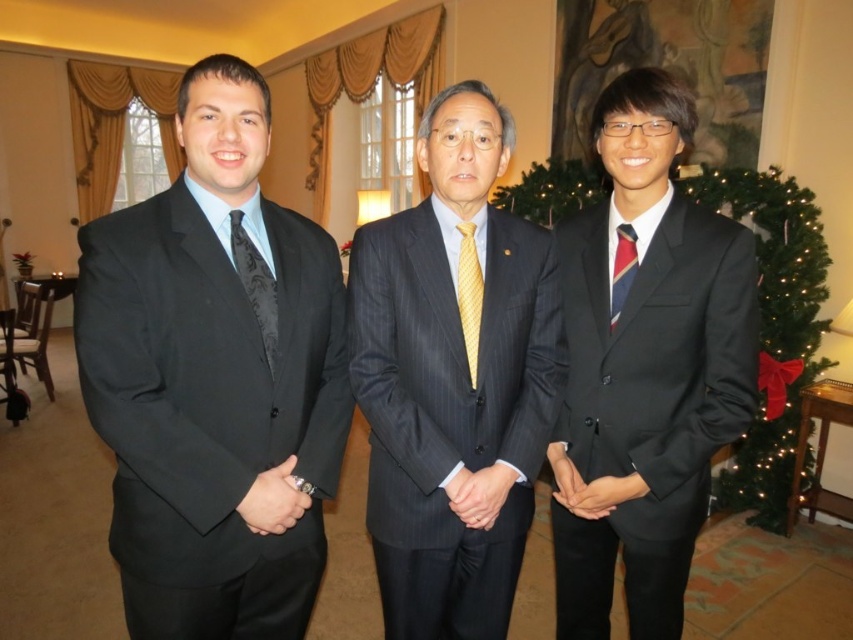
Question: Is dark gray pinstripe suit at center thinner than yellow silk tie at center?

Choices:
 (A) no
 (B) yes

Answer: (A)

Question: Which of the following is the farthest from the observer?

Choices:
 (A) matte black suit at left
 (B) yellow silk tie at center
 (C) striped silk tie at right
 (D) matte black suit at right

Answer: (C)

Question: Is dark gray pinstripe suit at center to the right of striped silk tie at right from the viewer's perspective?

Choices:
 (A) yes
 (B) no

Answer: (B)

Question: Which point appears closest to the camera in this image?

Choices:
 (A) click(291, 604)
 (B) click(473, 314)

Answer: (B)

Question: Which object is farther from the camera taking this photo?

Choices:
 (A) black satin tie at left
 (B) yellow silk tie at center
 (C) matte black suit at left
 (D) striped silk tie at right

Answer: (D)

Question: Does matte black suit at right appear on the left side of yellow silk tie at center?

Choices:
 (A) no
 (B) yes

Answer: (A)